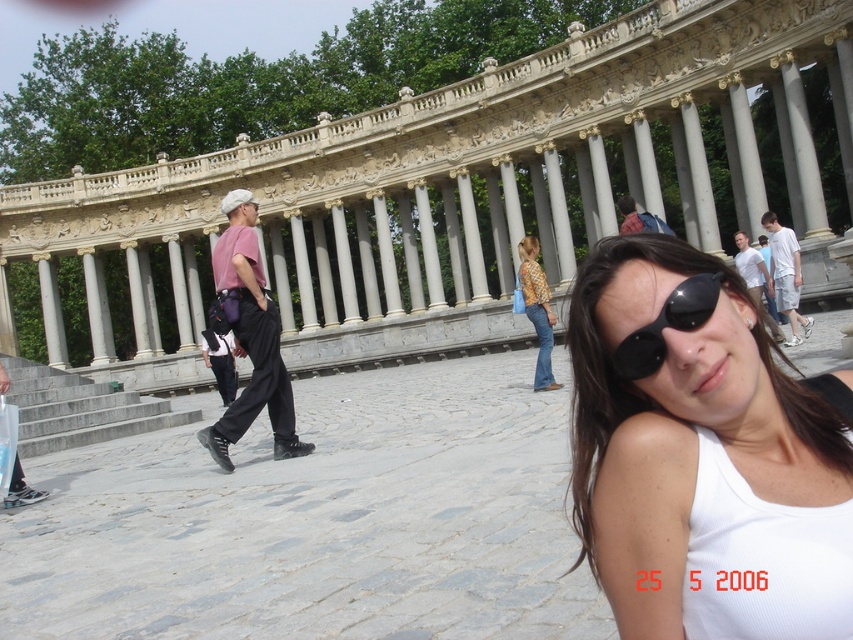
Question: Which point is closer to the camera?

Choices:
 (A) matte pink shirt at left
 (B) white matte tank top at center
 (C) yellow textured blouse at center

Answer: (B)

Question: Estimate the real-world distances between objects in this image. Which object is closer to the white matte tank top at center?

Choices:
 (A) yellow textured blouse at center
 (B) matte pink shirt at left
 (C) black reflective sunglasses at center

Answer: (C)

Question: Is black reflective sunglasses at center in front of yellow textured blouse at center?

Choices:
 (A) yes
 (B) no

Answer: (A)

Question: Considering the real-world distances, which object is closest to the white matte tank top at center?

Choices:
 (A) yellow textured blouse at center
 (B) black reflective sunglasses at center

Answer: (B)

Question: Can you confirm if matte pink shirt at left is wider than yellow textured blouse at center?

Choices:
 (A) yes
 (B) no

Answer: (A)

Question: Can you confirm if white matte tank top at center is smaller than matte pink shirt at left?

Choices:
 (A) yes
 (B) no

Answer: (A)